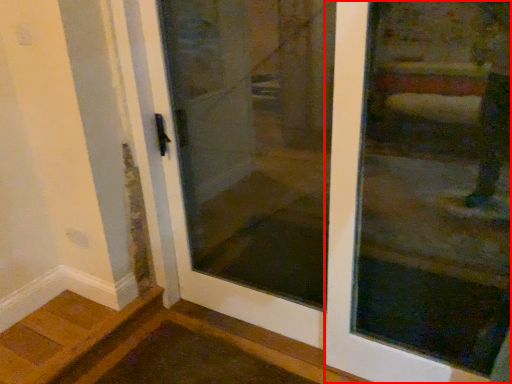
Question: Observing the image, what is the correct spatial positioning of door (annotated by the red box) in reference to elevator door?

Choices:
 (A) left
 (B) right

Answer: (B)